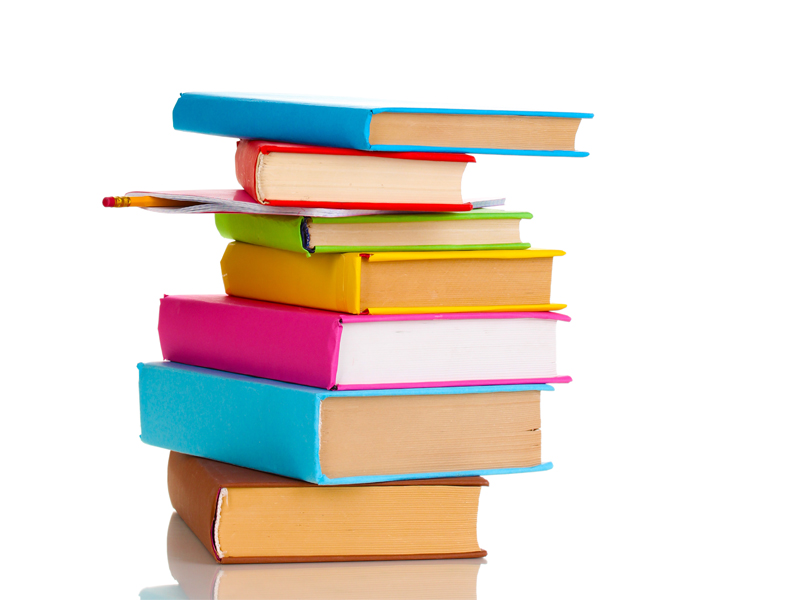
The height and width of the screenshot is (600, 800). What are the coordinates of `books` in the screenshot? It's located at (389, 120), (354, 180), (425, 229), (457, 301), (454, 352), (418, 430), (337, 504).